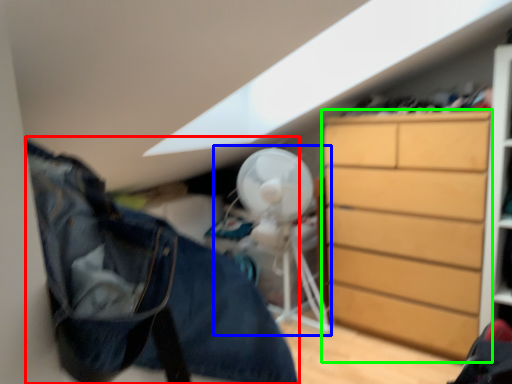
Question: Which object is positioned farthest from clothing (highlighted by a red box)? Select from mechanical fan (highlighted by a blue box) and chest of drawers (highlighted by a green box).

Choices:
 (A) mechanical fan
 (B) chest of drawers

Answer: (A)